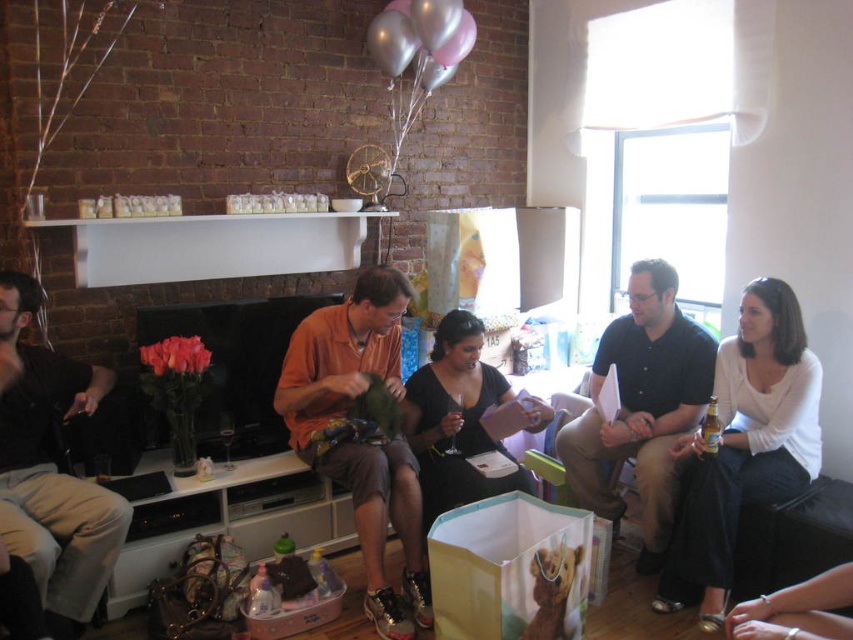
Question: Which of the following is the farthest from the observer?

Choices:
 (A) (53, 413)
 (B) (440, 493)

Answer: (B)

Question: Can you confirm if orange cotton shirt at center is wider than smooth silver bracelet at lower right?

Choices:
 (A) yes
 (B) no

Answer: (A)

Question: Does matte black shirt at left have a larger size compared to black satin dress at center?

Choices:
 (A) no
 (B) yes

Answer: (B)

Question: Is the position of white matte shirt at right less distant than that of matte black shirt at left?

Choices:
 (A) yes
 (B) no

Answer: (B)

Question: Among these objects, which one is nearest to the camera?

Choices:
 (A) dark blue shirt at center
 (B) black satin dress at center
 (C) orange cotton shirt at center

Answer: (C)

Question: Based on their relative distances, which object is farther from the orange cotton shirt at center?

Choices:
 (A) smooth silver bracelet at lower right
 (B) white matte shirt at right
 (C) dark blue shirt at center
 (D) black satin dress at center

Answer: (A)